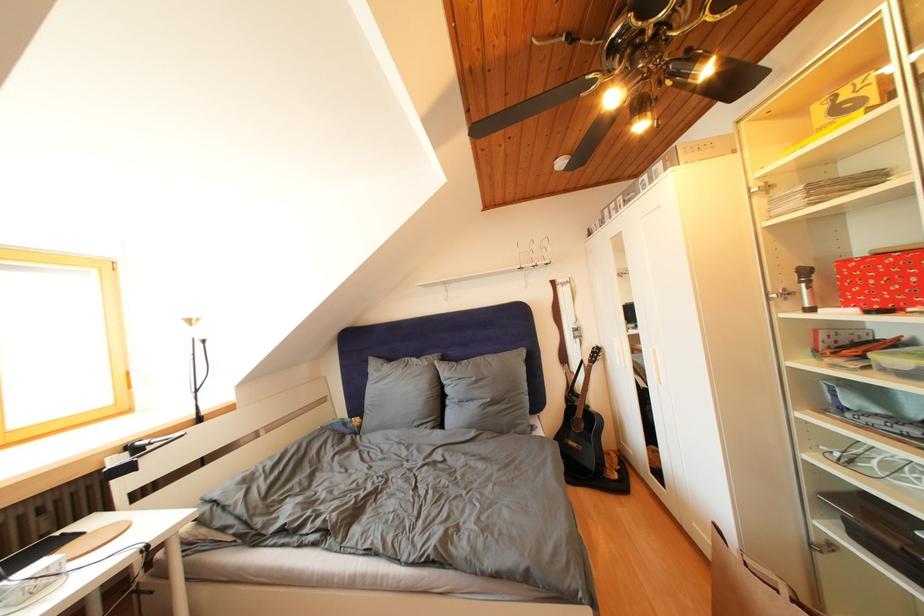
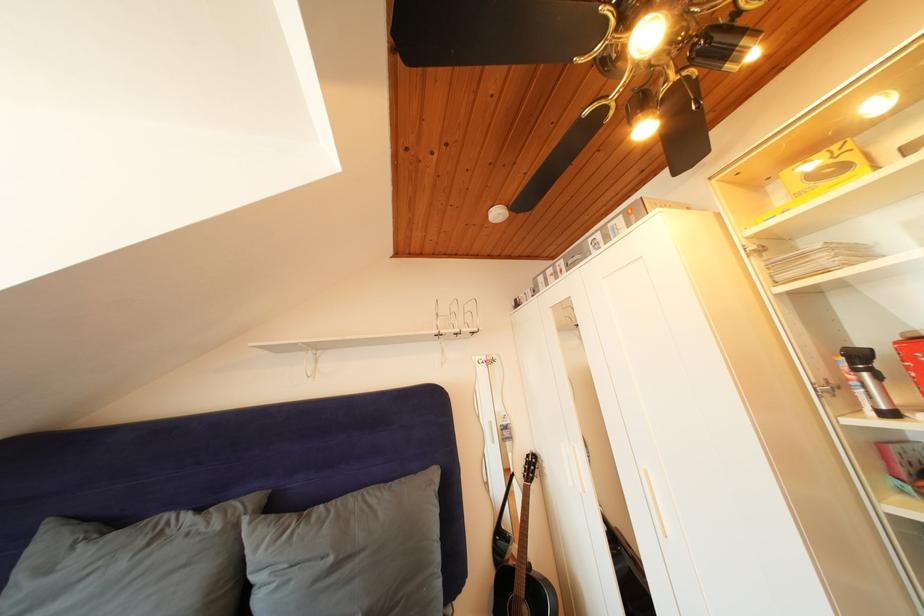
Find the pixel in the second image that matches (x=482, y=384) in the first image.

(338, 565)